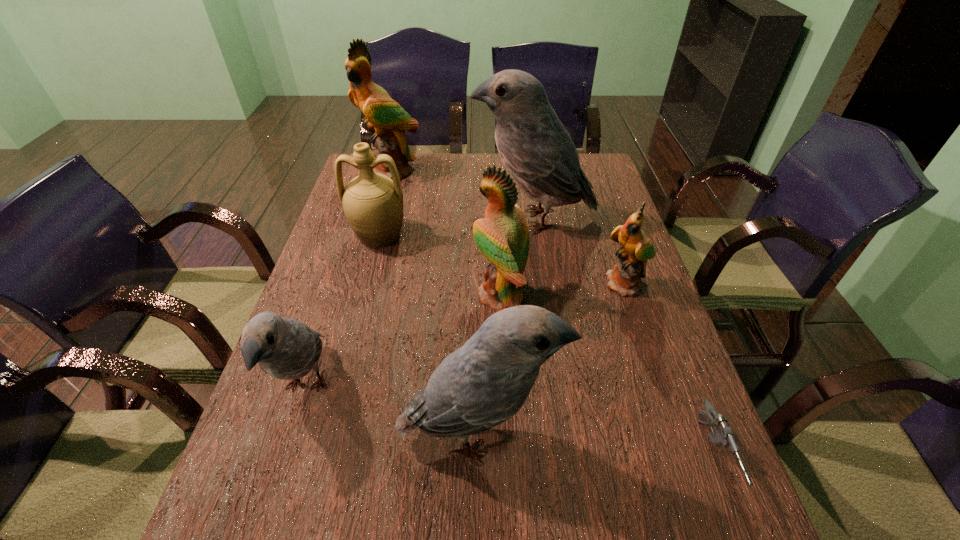
At what (x,y) coordinates should I click in order to perform the action: click on free spot between the leftmost green parrot and the second smallest gray parrot. Please return your answer as a coordinate pair (x, y). Looking at the image, I should click on click(435, 303).

I want to click on vacant point located between the shortest object and the smallest gray parrot, so click(x=510, y=421).

The width and height of the screenshot is (960, 540). In order to click on free space between the second smallest green parrot and the gun in this screenshot , I will do `click(607, 375)`.

I want to click on free space between the farthest parrot and the second smallest green parrot, so click(x=445, y=233).

Find the location of a particular element. This screenshot has height=540, width=960. vacant area that lies between the pitcher and the leftmost gray parrot is located at coordinates (x=343, y=310).

This screenshot has width=960, height=540. I want to click on vacant space that is in between the shortest object and the farthest gray parrot, so click(623, 338).

Where is `vacant space that is in between the gun and the second smallest gray parrot`? This screenshot has width=960, height=540. vacant space that is in between the gun and the second smallest gray parrot is located at coordinates pyautogui.click(x=595, y=446).

Locate an element on the screen. vacant space that is in between the second farthest parrot and the biggest green parrot is located at coordinates (462, 195).

This screenshot has width=960, height=540. In order to click on object that is the closest one to the second smallest green parrot in this screenshot , I will do `click(535, 147)`.

Select which object is the seventh closest to the second green parrot from left to right. Please provide its 2D coordinates. Your answer should be formatted as a tuple, i.e. [(x, y)], where the tuple contains the x and y coordinates of a point satisfying the conditions above.

[(384, 117)]